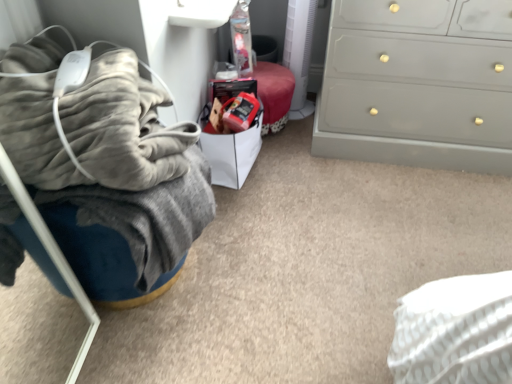
Question: Is matte gray dresser at right wider or thinner than white paper bag at center?

Choices:
 (A) thin
 (B) wide

Answer: (B)

Question: In terms of height, does matte gray dresser at right look taller or shorter compared to white paper bag at center?

Choices:
 (A) short
 (B) tall

Answer: (B)

Question: Which is farther from the matte gray dresser at right?

Choices:
 (A) white paper bag at center
 (B) velvety gray blanket at left

Answer: (B)

Question: Based on their relative distances, which object is nearer to the velvety gray blanket at left?

Choices:
 (A) white paper bag at center
 (B) matte gray dresser at right

Answer: (A)